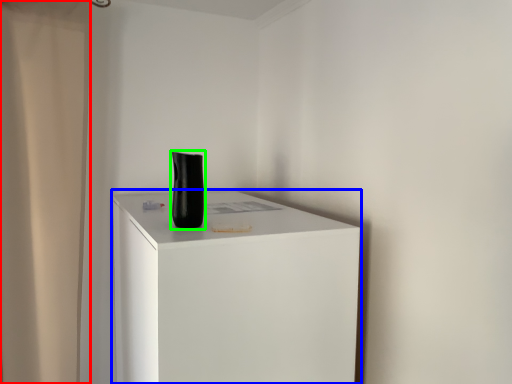
Question: Estimate the real-world distances between objects in this image. Which object is closer to shower curtain (highlighted by a red box), furniture (highlighted by a blue box) or vase (highlighted by a green box)?

Choices:
 (A) furniture
 (B) vase

Answer: (A)